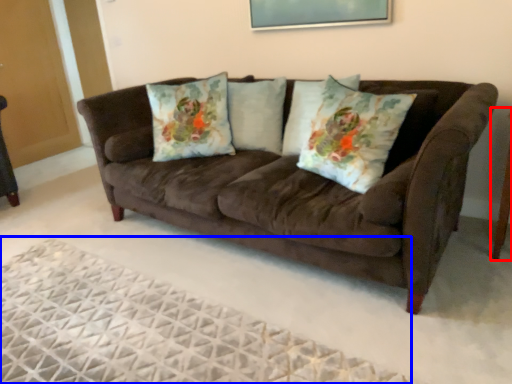
Question: Which object is closer to the camera taking this photo, side table (highlighted by a red box) or plain (highlighted by a blue box)?

Choices:
 (A) side table
 (B) plain

Answer: (B)